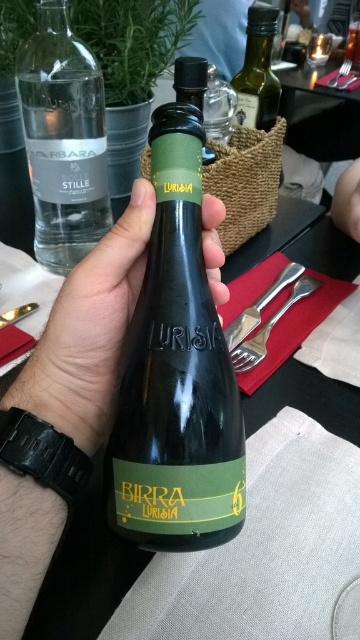
Does clear glass bottle at upper left have a lesser height compared to clear glass bottle at upper center?

In fact, clear glass bottle at upper left may be taller than clear glass bottle at upper center.

What do you see at coordinates (64, 140) in the screenshot? This screenshot has height=640, width=360. I see `clear glass bottle at upper left` at bounding box center [64, 140].

Find the location of a particular element. clear glass bottle at upper left is located at coordinates (64, 140).

How much distance is there between green glass bottle at upper right and green matte bottle at center?

green glass bottle at upper right is 4.43 inches away from green matte bottle at center.

Can you confirm if green glass bottle at upper right is thinner than green matte bottle at center?

No, green glass bottle at upper right is not thinner than green matte bottle at center.

The width and height of the screenshot is (360, 640). What are the coordinates of `green glass bottle at upper right` in the screenshot? It's located at (258, 72).

The width and height of the screenshot is (360, 640). Identify the location of green glass bottle at upper right. (258, 72).

Between satin silver fork at lower right and shiny silver fork at upper center, which one has more height?

With more height is shiny silver fork at upper center.

Does satin silver fork at lower right have a larger size compared to shiny silver fork at upper center?

No.

Which is behind, point (235, 360) or point (344, 84)?

The point (344, 84) is more distant.

At what (x,y) coordinates should I click in order to perform the action: click on satin silver fork at lower right. Please return your answer as a coordinate pair (x, y). This screenshot has height=640, width=360. Looking at the image, I should click on (270, 323).